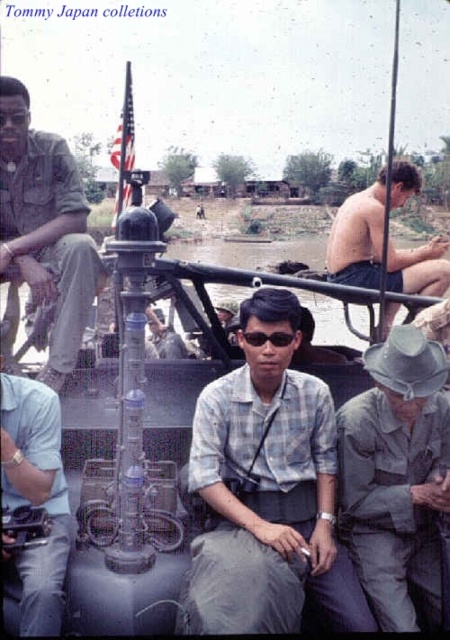
Is point (262, 400) farther from camera compared to point (251, 333)?

Yes, it is.

Who is more forward, [282,621] or [287,340]?

Point [282,621]

Locate an element on the screen. This screenshot has width=450, height=640. plaid shirt at center is located at coordinates 268,490.

Does gray matte uniform at lower right appear on the right side of light blue shirt at center?

Yes, gray matte uniform at lower right is to the right of light blue shirt at center.

Who is taller, gray matte uniform at lower right or light blue shirt at center?

With more height is gray matte uniform at lower right.

You are a GUI agent. You are given a task and a screenshot of the screen. Output one action in this format:
    pyautogui.click(x=<x>, y=<y>)
    Task: Click on the gray matte uniform at lower right
    The image size is (450, 640).
    Given the screenshot: What is the action you would take?
    pyautogui.click(x=396, y=476)

You are a GUI agent. You are given a task and a screenshot of the screen. Output one action in this format:
    pyautogui.click(x=<x>, y=<y>)
    Task: Click on the gray matte uniform at lower right
    
    Given the screenshot: What is the action you would take?
    coord(396,476)

How far apart are gray matte uniform at lower right and brushed metal helmet at upper left?

2.27 meters

Can you confirm if gray matte uniform at lower right is shorter than brushed metal helmet at upper left?

Correct, gray matte uniform at lower right is not as tall as brushed metal helmet at upper left.

Does point (404, 529) lie in front of point (37, 298)?

Yes, point (404, 529) is closer to viewer.

Locate an element on the screen. Image resolution: width=450 pixels, height=640 pixels. gray matte uniform at lower right is located at coordinates (396, 476).